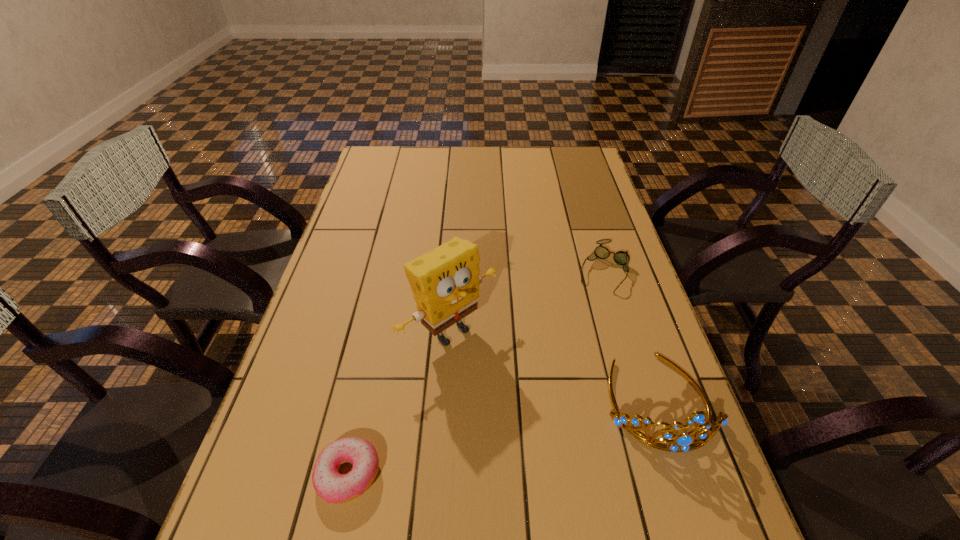
You are a GUI agent. You are given a task and a screenshot of the screen. Output one action in this format:
    pyautogui.click(x=<x>, y=<y>)
    Task: Click on the vacant space located 0.340m on the front-facing side of the farthest object
    Image resolution: width=960 pixels, height=540 pixels.
    Given the screenshot: What is the action you would take?
    pyautogui.click(x=552, y=382)

Where is `vacant space located on the front-facing side of the farthest object`? The image size is (960, 540). vacant space located on the front-facing side of the farthest object is located at coordinates (577, 333).

Locate an element on the screen. free location located 0.150m on the front-facing side of the farthest object is located at coordinates (579, 327).

Find the location of a particular element. The width and height of the screenshot is (960, 540). object positioned at the near edge is located at coordinates (331, 486).

At what (x,y) coordinates should I click in order to perform the action: click on object situated at the left edge. Please return your answer as a coordinate pair (x, y). Looking at the image, I should click on [x=331, y=486].

Find the location of `tiara situated at the right edge`. tiara situated at the right edge is located at coordinates (684, 442).

Image resolution: width=960 pixels, height=540 pixels. In order to click on spectacles that is positioned at the right edge in this screenshot , I will do `click(621, 258)`.

You are a GUI agent. You are given a task and a screenshot of the screen. Output one action in this format:
    pyautogui.click(x=<x>, y=<y>)
    Task: Click on the object that is at the near left corner
    The image size is (960, 540).
    Given the screenshot: What is the action you would take?
    pyautogui.click(x=331, y=486)

Image resolution: width=960 pixels, height=540 pixels. In the image, there is a desktop. In order to click on vacant space at the far edge in this screenshot , I will do (x=427, y=149).

Locate an element on the screen. Image resolution: width=960 pixels, height=540 pixels. vacant area at the near edge of the desktop is located at coordinates (569, 504).